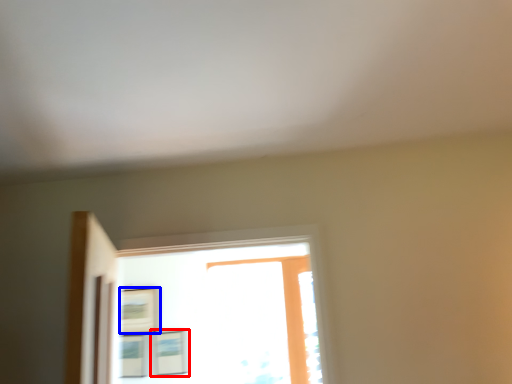
Question: Which of the following is the farthest to the observer, picture frame (highlighted by a red box) or picture frame (highlighted by a blue box)?

Choices:
 (A) picture frame
 (B) picture frame

Answer: (B)